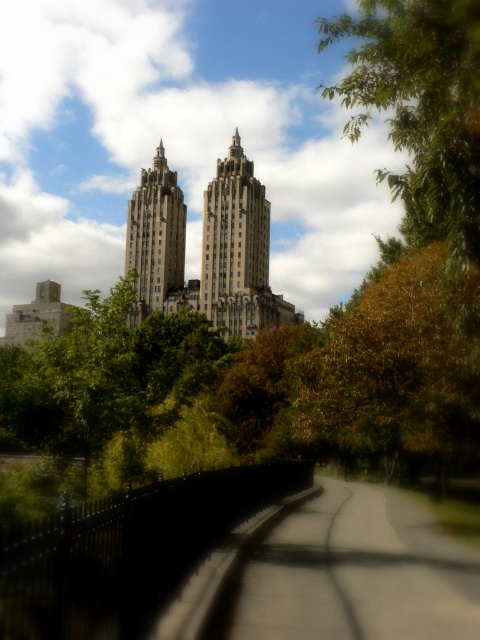
You are a pedestrian standing on the smooth asphalt path at center and want to reach the green leafy tree at upper right. Which direction should you move to get there?

You should move to the right because the green leafy tree at upper right is to the right of the smooth asphalt path at center.

You are a gardener who needs to water the green leafy tree at upper right. The smooth asphalt path at center is in the way. Can you walk along the path to reach the tree?

The smooth asphalt path at center is positioned under green leafy tree at upper right, so you can walk along the path to reach the tree.

You are a gardener who needs to mow the lawn between the smooth asphalt path at center and the brown leafy tree at center. Which area has a larger space to work in?

The smooth asphalt path at center has a larger space to work in because its width surpasses that of the brown leafy tree at center.